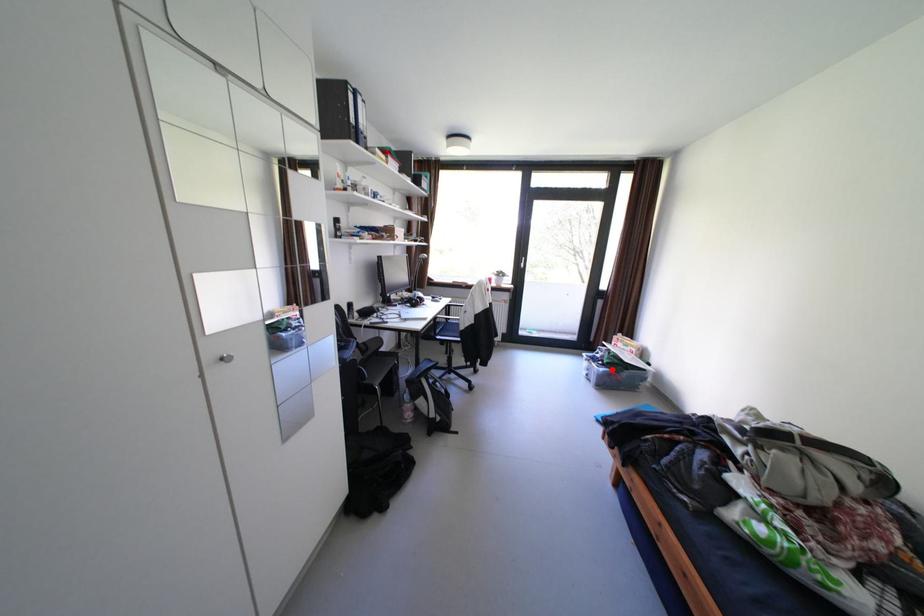
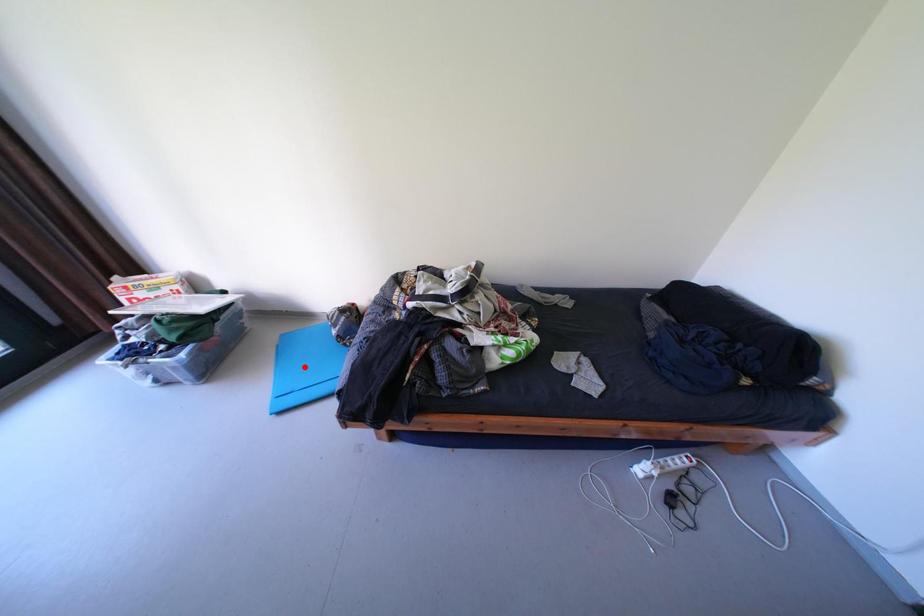
I am providing you with two images of the same scene from different viewpoints. A red point is marked on the first image and another point is marked on the second image. Does the point marked in image1 correspond to the same location as the one in image2?

No